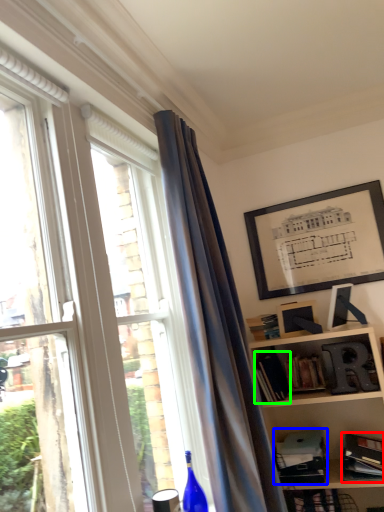
Question: Considering the real-world distances, which object is farthest from book (highlighted by a red box)? paperback book (highlighted by a blue box) or book (highlighted by a green box)?

Choices:
 (A) paperback book
 (B) book

Answer: (B)